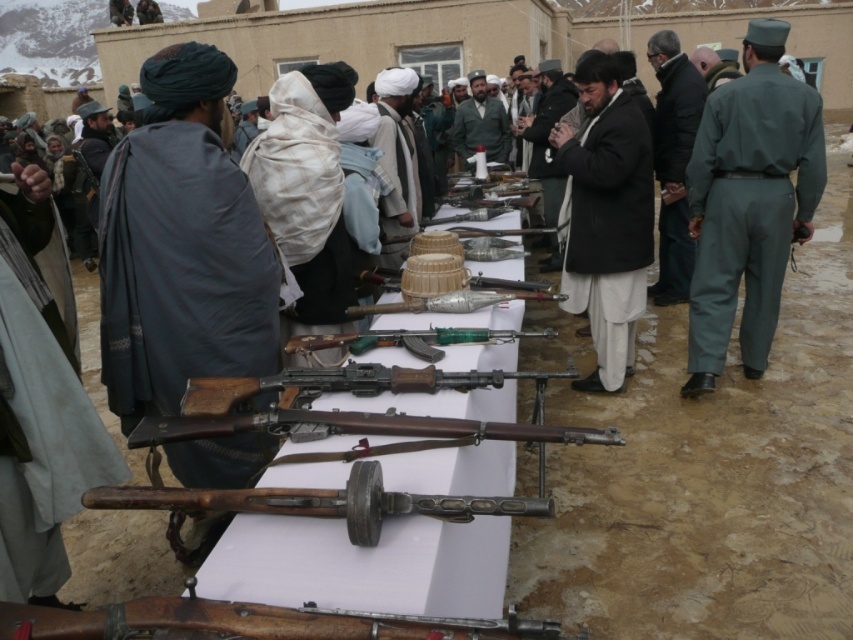
Is green uniform pants at right closer to camera compared to rusty wood rifle at center?

That is False.

Does green uniform pants at right have a greater width compared to rusty wood rifle at center?

Incorrect, green uniform pants at right's width does not surpass rusty wood rifle at center's.

Between point (706, 307) and point (117, 628), which one is positioned in front?

Point (117, 628)

Find the location of `green uniform pants at right`. green uniform pants at right is located at coordinates (747, 208).

Is point (125, 323) farther from viewer compared to point (212, 624)?

Yes, it is.

Does dark gray woolen robe at left appear under rusty wood rifle at center?

No, dark gray woolen robe at left is not below rusty wood rifle at center.

The height and width of the screenshot is (640, 853). Identify the location of dark gray woolen robe at left. (180, 269).

Image resolution: width=853 pixels, height=640 pixels. I want to click on dark gray woolen robe at left, so click(180, 269).

Does rusty wood rifle at center have a smaller size compared to dark brown woolen coat at center?

Yes, rusty wood rifle at center is smaller than dark brown woolen coat at center.

Between rusty wood rifle at center and dark brown woolen coat at center, which one has more height?

dark brown woolen coat at center

Does point (151, 596) come behind point (547, 109)?

No.

I want to click on rusty wood rifle at center, so click(x=251, y=621).